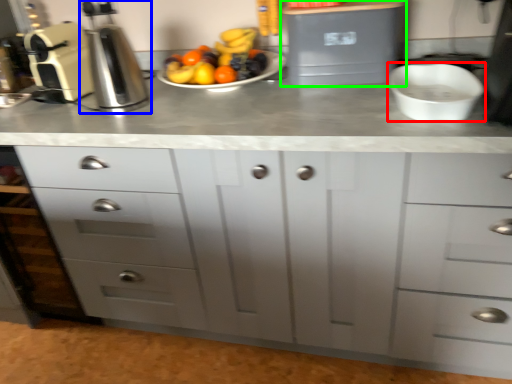
Question: Which is nearer to the mixing bowl (highlighted by a red box)? coffee machine (highlighted by a blue box) or appliance (highlighted by a green box).

Choices:
 (A) coffee machine
 (B) appliance

Answer: (B)